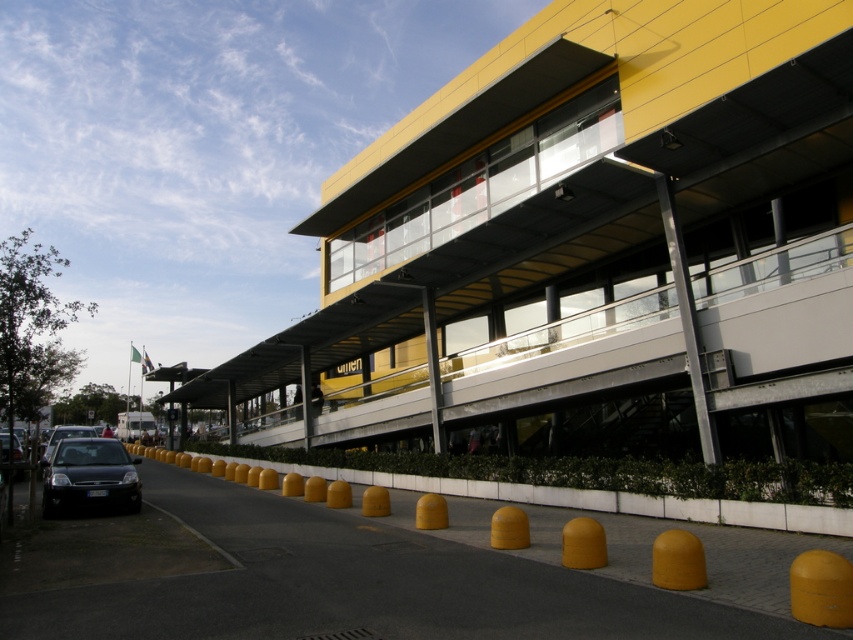
Between yellow rubber bollard at lower center and shiny black car at left, which one has less height?

yellow rubber bollard at lower center is shorter.

Consider the image. Measure the distance between yellow rubber bollard at lower center and camera.

yellow rubber bollard at lower center is 28.32 feet from camera.

Does point (721, 516) come behind point (78, 428)?

No, it is not.

Identify the location of yellow rubber bollard at lower center. The width and height of the screenshot is (853, 640). (622, 492).

Where is `yellow matte parking garage at center`? The width and height of the screenshot is (853, 640). yellow matte parking garage at center is located at coordinates [589, 257].

Which is in front, point (769, 307) or point (91, 452)?

Point (769, 307)

In order to click on yellow matte parking garage at center in this screenshot , I will do `click(589, 257)`.

Is point (727, 483) closer to camera compared to point (88, 472)?

That is True.

Which of these two, yellow rubber bollard at lower center or shiny black car at lower left, stands shorter?

With less height is yellow rubber bollard at lower center.

Which is behind, point (790, 481) or point (54, 458)?

Positioned behind is point (54, 458).

This screenshot has height=640, width=853. What are the coordinates of `yellow rubber bollard at lower center` in the screenshot? It's located at (622, 492).